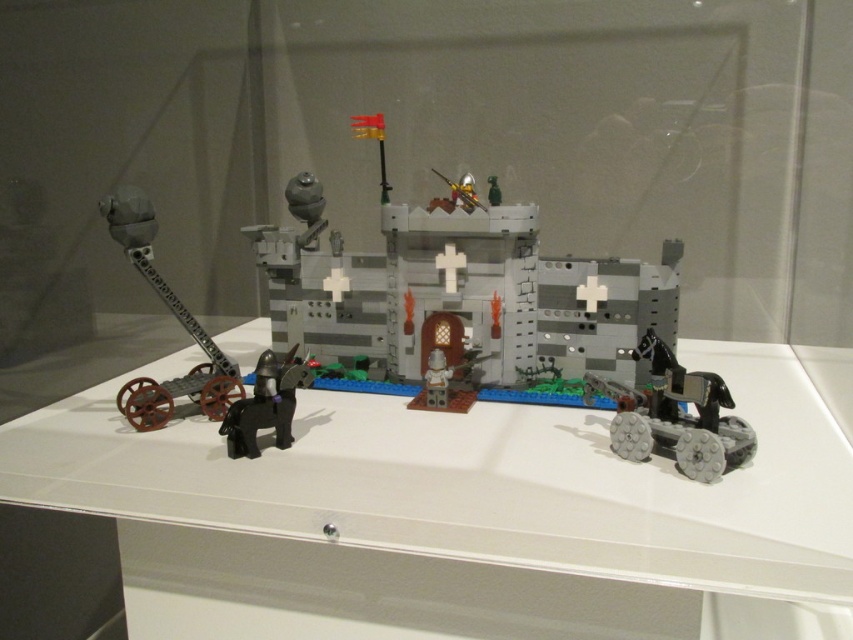
You are a museum curator planning to move the brick gray catapult at left to the right side of the white plastic table at center. Will the catapult fit next to the table without overlapping it?

The white plastic table at center is wider than the brick gray catapult at left, so there should be enough space to place the catapult next to the table without overlapping.

You are a security guard in the museum. You need to check the distance between the metallic gray tank at lower right and the matte black horse at lower left to ensure visitors can walk around them safely. According to the scene description, which object is positioned lower in the image?

The metallic gray tank at lower right is located below the matte black horse at lower left, so it is positioned lower in the image.

You are a visitor standing in front of the Lego castle display. You notice two points marked on the glass cover. The first point is at coordinates point [672,580] and the second point is at point [112,209]. From your perspective, which point is closer to you?

Point [672,580] is in front of point [112,209], so it is closer to you.